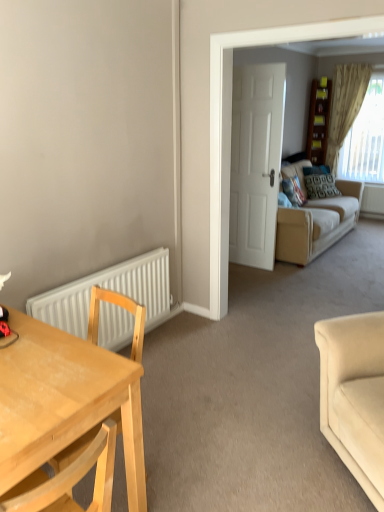
Question: Is beige textured curtain at upper right positioned behind white matte radiator at lower left?

Choices:
 (A) no
 (B) yes

Answer: (B)

Question: Is beige textured curtain at upper right directly adjacent to white matte radiator at lower left?

Choices:
 (A) no
 (B) yes

Answer: (A)

Question: From the image's perspective, is beige textured curtain at upper right on white matte radiator at lower left?

Choices:
 (A) no
 (B) yes

Answer: (B)

Question: From the image's perspective, does beige textured curtain at upper right appear lower than white matte radiator at lower left?

Choices:
 (A) no
 (B) yes

Answer: (A)

Question: Can you confirm if beige textured curtain at upper right is taller than white matte radiator at lower left?

Choices:
 (A) no
 (B) yes

Answer: (B)

Question: From the image's perspective, is beige fabric couch at right, placed as the 1th studio couch when sorted from top to bottom, above or below light wood desk at left?

Choices:
 (A) below
 (B) above

Answer: (B)

Question: Considering the positions of beige fabric couch at right, the first studio couch when ordered from back to front, and light wood desk at left in the image, is beige fabric couch at right, the first studio couch when ordered from back to front, bigger or smaller than light wood desk at left?

Choices:
 (A) small
 (B) big

Answer: (B)

Question: Is beige fabric couch at right, placed as the 1th studio couch when sorted from top to bottom, wider or thinner than light wood desk at left?

Choices:
 (A) thin
 (B) wide

Answer: (A)

Question: Would you say beige fabric couch at right, placed as the 1th studio couch when sorted from top to bottom, is to the left or to the right of light wood desk at left in the picture?

Choices:
 (A) left
 (B) right

Answer: (B)

Question: Considering the positions of velvet blue pillow at center-right, which is the second pillow in back-to-front order, and patterned fabric pillow at center, the 1th pillow positioned from the back, in the image, is velvet blue pillow at center-right, which is the second pillow in back-to-front order, bigger or smaller than patterned fabric pillow at center, the 1th pillow positioned from the back,?

Choices:
 (A) small
 (B) big

Answer: (A)

Question: Visually, is velvet blue pillow at center-right, the second pillow when ordered from right to left, positioned to the left or to the right of patterned fabric pillow at center, which appears as the 1th pillow when viewed from the right?

Choices:
 (A) left
 (B) right

Answer: (A)

Question: Considering the positions of velvet blue pillow at center-right, the second pillow when ordered from right to left, and patterned fabric pillow at center, the second pillow when ordered from front to back, in the image, is velvet blue pillow at center-right, the second pillow when ordered from right to left, wider or thinner than patterned fabric pillow at center, the second pillow when ordered from front to back,?

Choices:
 (A) thin
 (B) wide

Answer: (A)

Question: From a real-world perspective, is velvet blue pillow at center-right, the second pillow when ordered from right to left, positioned above or below patterned fabric pillow at center, the 1th pillow positioned from the back?

Choices:
 (A) below
 (B) above

Answer: (B)

Question: Do you think beige textured curtain at upper right is within patterned fabric pillow at center, positioned as the 2th pillow in left-to-right order, or outside of it?

Choices:
 (A) inside
 (B) outside

Answer: (B)

Question: Is beige textured curtain at upper right taller or shorter than patterned fabric pillow at center, the second pillow when ordered from front to back?

Choices:
 (A) tall
 (B) short

Answer: (A)